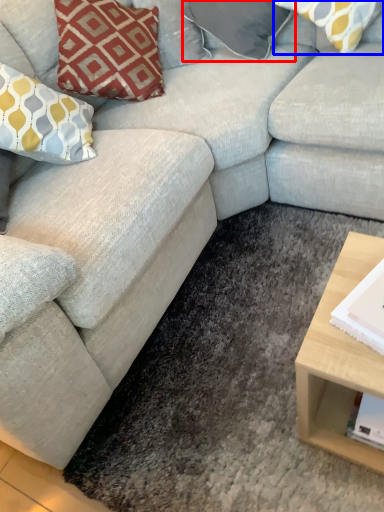
Question: Which object appears closest to the camera in this image, pillow (highlighted by a red box) or pillow (highlighted by a blue box)?

Choices:
 (A) pillow
 (B) pillow

Answer: (B)